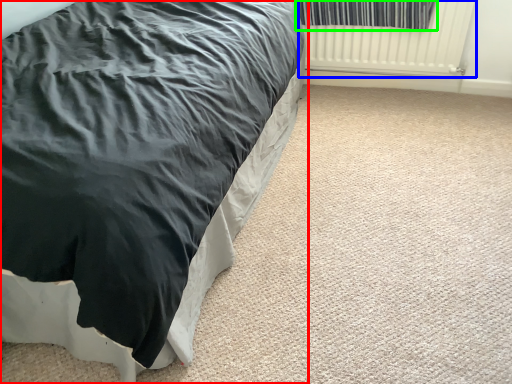
Question: Which object is positioned farthest from bed (highlighted by a red box)? Select from radiator (highlighted by a blue box) and curtain (highlighted by a green box).

Choices:
 (A) radiator
 (B) curtain

Answer: (A)